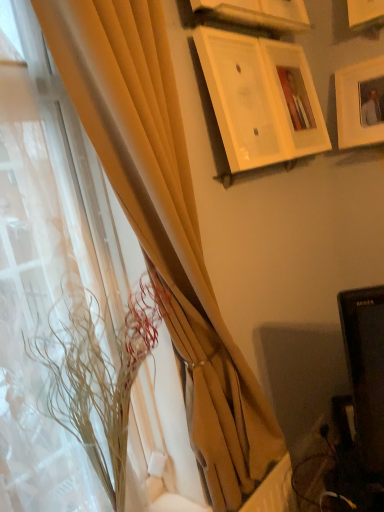
Question: In terms of height, does matte yellow curtain at left, arranged as the first curtain when viewed from the right, look taller or shorter compared to matte yellow curtain at left, the 1th curtain positioned from the left?

Choices:
 (A) short
 (B) tall

Answer: (B)

Question: In the image, is matte yellow curtain at left, the second curtain in the left-to-right sequence, positioned in front of or behind matte yellow curtain at left, positioned as the 2th curtain in right-to-left order?

Choices:
 (A) front
 (B) behind

Answer: (A)

Question: Which object is the closest to the white glossy picture frame at upper center, the 4th picture frame from the right?

Choices:
 (A) wooden picture frame at upper center, the second picture frame when ordered from left to right
 (B) matte yellow curtain at left, positioned as the 2th curtain in right-to-left order
 (C) white matte picture frame at upper right, which is the first picture frame from right to left
 (D) wooden picture frame at upper center, which is counted as the 2th picture frame, starting from the right
 (E) matte yellow curtain at left, the second curtain in the left-to-right sequence

Answer: (D)

Question: Estimate the real-world distances between objects in this image. Which object is closer to the white glossy picture frame at upper center, the 1th picture frame from the left?

Choices:
 (A) white matte picture frame at upper right, the fourth picture frame in the left-to-right sequence
 (B) matte yellow curtain at left, the 1th curtain positioned from the left
 (C) wooden picture frame at upper center, which is the 3th picture frame in left-to-right order
 (D) wooden picture frame at upper center, the 3th picture frame in the right-to-left sequence
 (E) dry grass at left

Answer: (C)